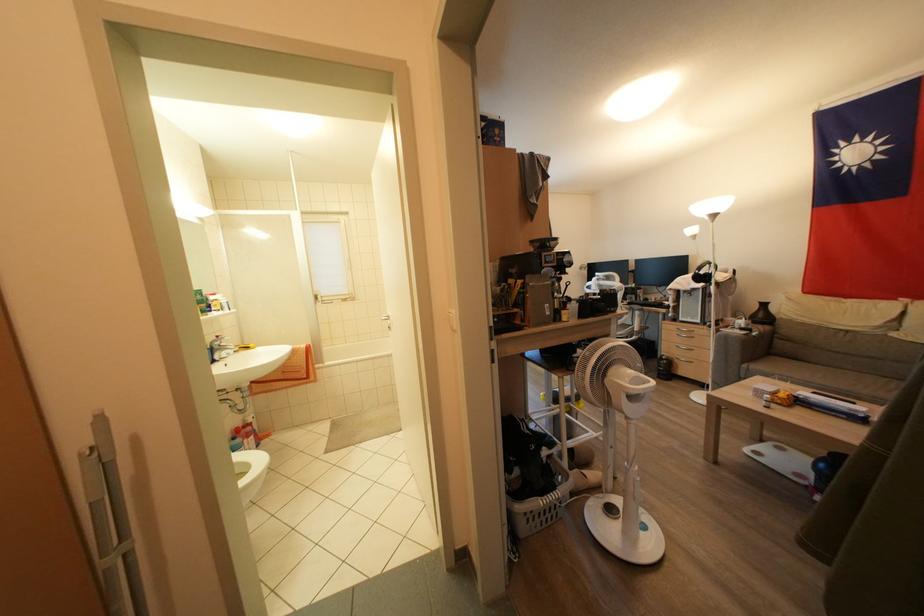
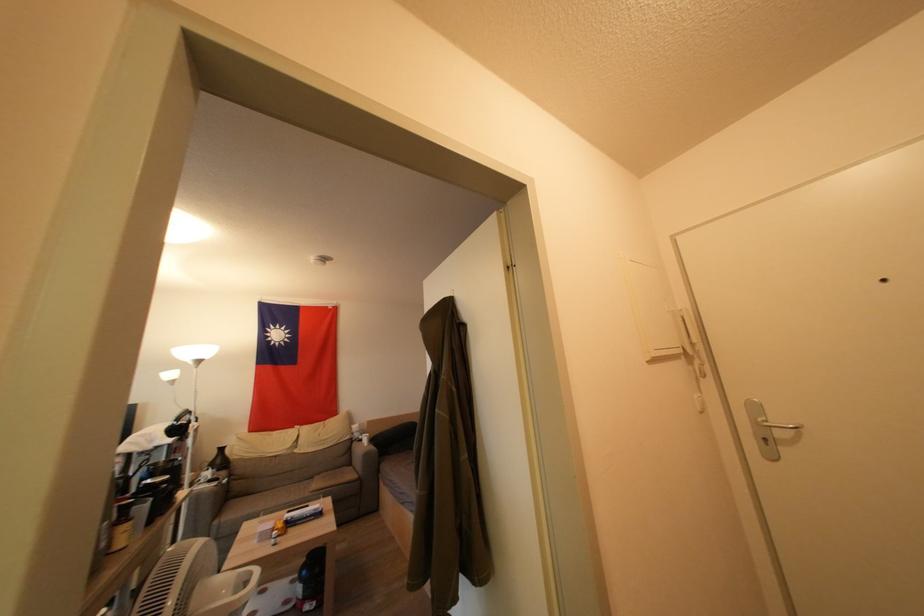
The point at (766, 320) is marked in the first image. Where is the corresponding point in the second image?

(224, 464)